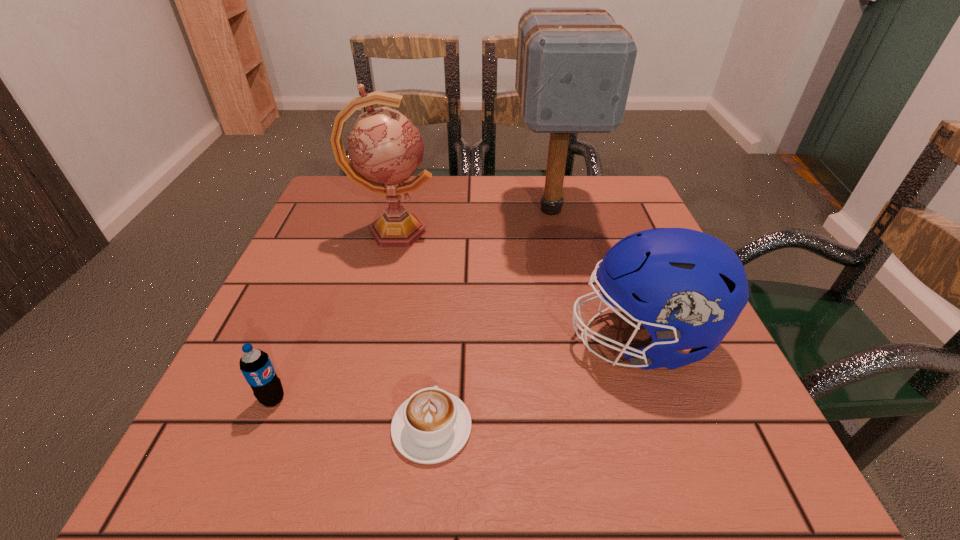
Locate an element on the screen. vacant region located 0.320m on the front-facing side of the third shortest object is located at coordinates (384, 339).

The height and width of the screenshot is (540, 960). Find the location of `vacant area situated on the front-facing side of the third shortest object`. vacant area situated on the front-facing side of the third shortest object is located at coordinates (540, 339).

The width and height of the screenshot is (960, 540). Find the location of `vacant space located 0.330m on the right of the soda bottle`. vacant space located 0.330m on the right of the soda bottle is located at coordinates (500, 399).

At what (x,y) coordinates should I click in order to perform the action: click on free point located 0.370m with the handle on the right side of the shortest object. Please return your answer as a coordinate pair (x, y). The width and height of the screenshot is (960, 540). Looking at the image, I should click on (447, 249).

This screenshot has width=960, height=540. Find the location of `vacant point located with the handle on the right side of the shortest object`. vacant point located with the handle on the right side of the shortest object is located at coordinates (446, 264).

At what (x,y) coordinates should I click in order to perform the action: click on vacant area situated 0.390m with the handle on the right side of the shortest object. Please return your answer as a coordinate pair (x, y). Looking at the image, I should click on (448, 244).

Image resolution: width=960 pixels, height=540 pixels. I want to click on mallet that is at the far edge, so click(574, 66).

At what (x,y) coordinates should I click in order to perform the action: click on globe positioned at the far edge. Please return your answer as a coordinate pair (x, y). Looking at the image, I should click on (385, 148).

The width and height of the screenshot is (960, 540). Identify the location of object present at the near edge. (431, 426).

What are the coordinates of `globe at the left edge` in the screenshot? It's located at (385, 148).